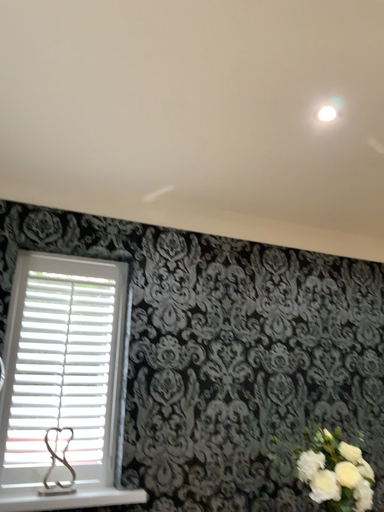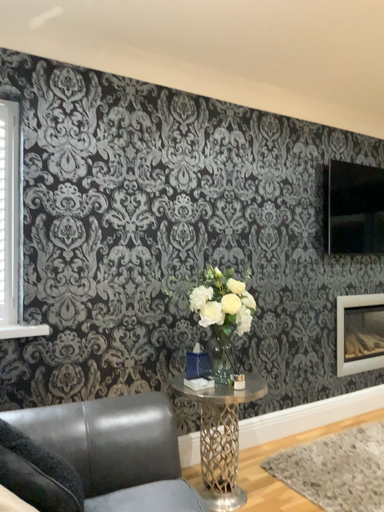
Question: Which way did the camera rotate in the video?

Choices:
 (A) rotated right
 (B) rotated left

Answer: (A)